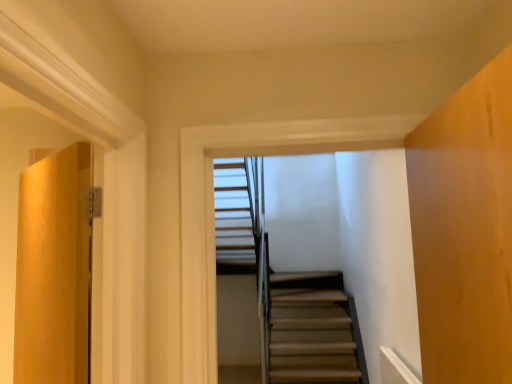
The height and width of the screenshot is (384, 512). Identify the location of wooden stairs at center. (285, 290).

What do you see at coordinates (285, 290) in the screenshot? I see `wooden stairs at center` at bounding box center [285, 290].

What do you see at coordinates (54, 269) in the screenshot? I see `matte wood door at left` at bounding box center [54, 269].

In order to face matte wood door at left, should I rotate leftwards or rightwards?

You should look left and rotate roughly 26.147 degrees.

Where is `matte wood door at left`? The height and width of the screenshot is (384, 512). matte wood door at left is located at coordinates (54, 269).

Locate an element on the screen. wooden stairs at center is located at coordinates (285, 290).

From the picture: Visually, is wooden stairs at center positioned to the left or to the right of matte wood door at left?

Based on their positions, wooden stairs at center is located to the right of matte wood door at left.

Which is behind, wooden stairs at center or matte wood door at left?

Positioned behind is wooden stairs at center.

Considering the points (286, 315) and (41, 285), which point is in front, point (286, 315) or point (41, 285)?

The point (41, 285) is in front.

From the image's perspective, is wooden stairs at center beneath matte wood door at left?

No, from the image's perspective, wooden stairs at center is not below matte wood door at left.

From a real-world perspective, is wooden stairs at center on top of matte wood door at left?

Yes.

Which object is thinner, wooden stairs at center or matte wood door at left?

wooden stairs at center.

Can you confirm if wooden stairs at center is shorter than matte wood door at left?

Yes, wooden stairs at center is shorter than matte wood door at left.

Who is smaller, wooden stairs at center or matte wood door at left?

With smaller size is wooden stairs at center.

Is wooden stairs at center not inside matte wood door at left?

wooden stairs at center is positioned outside matte wood door at left.

Is wooden stairs at center far away from matte wood door at left?

wooden stairs at center is far away from matte wood door at left.

Is wooden stairs at center facing towards matte wood door at left?

No, wooden stairs at center is not oriented towards matte wood door at left.

How different are the orientations of wooden stairs at center and matte wood door at left in degrees?

42.9 degrees.

Locate an element on the screen. door that is below the wooden stairs at center (from the image's perspective) is located at coordinates (54, 269).

Considering the positions of objects matte wood door at left and wooden stairs at center in the image provided, who is more to the left, matte wood door at left or wooden stairs at center?

matte wood door at left.

Is matte wood door at left in front of or behind wooden stairs at center in the image?

In the image, matte wood door at left appears in front of wooden stairs at center.

Does point (47, 267) come in front of point (234, 160)?

Yes, it is in front of point (234, 160).

From the image's perspective, would you say matte wood door at left is positioned over wooden stairs at center?

No, from the image's perspective, matte wood door at left is not over wooden stairs at center.

From a real-world perspective, which object rests below the other?

matte wood door at left.

Between matte wood door at left and wooden stairs at center, which one has smaller width?

With smaller width is wooden stairs at center.

Who is shorter, matte wood door at left or wooden stairs at center?

wooden stairs at center is shorter.

Can you confirm if matte wood door at left is bigger than wooden stairs at center?

Indeed, matte wood door at left has a larger size compared to wooden stairs at center.

Is matte wood door at left outside of wooden stairs at center?

Indeed, matte wood door at left is completely outside wooden stairs at center.

Are matte wood door at left and wooden stairs at center located far from each other?

That's right, there is a large distance between matte wood door at left and wooden stairs at center.

Does matte wood door at left turn towards wooden stairs at center?

No, matte wood door at left is not facing towards wooden stairs at center.

What's the angular difference between matte wood door at left and wooden stairs at center's facing directions?

The angular difference between matte wood door at left and wooden stairs at center is 42.9 degrees.

At what (x,y) coordinates should I click in order to perform the action: click on stairs behind the matte wood door at left. Please return your answer as a coordinate pair (x, y). The width and height of the screenshot is (512, 384). Looking at the image, I should click on (285, 290).

Identify the location of door that is on the left side of wooden stairs at center. (54, 269).

At what (x,y) coordinates should I click in order to perform the action: click on stairs above the matte wood door at left (from the image's perspective). Please return your answer as a coordinate pair (x, y). The width and height of the screenshot is (512, 384). Looking at the image, I should click on (285, 290).